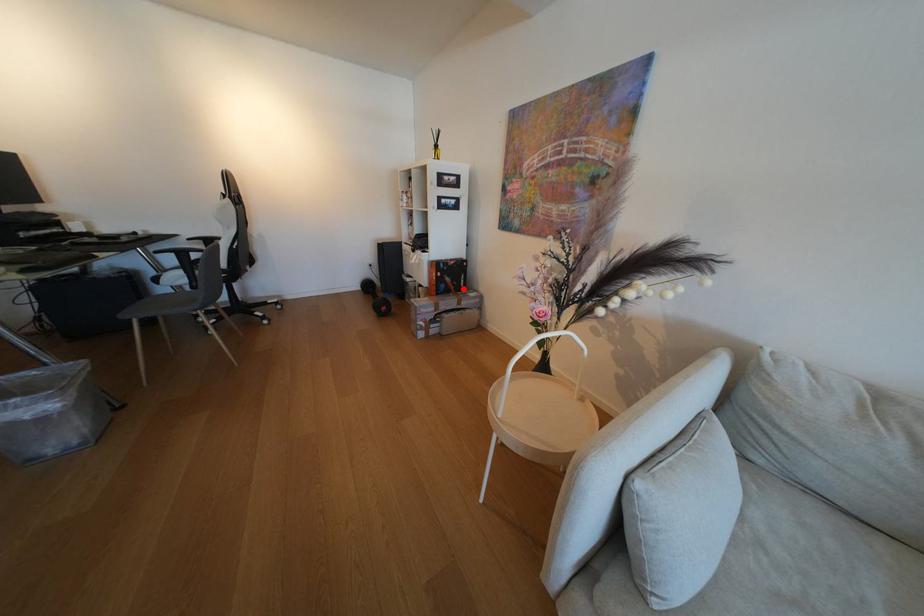
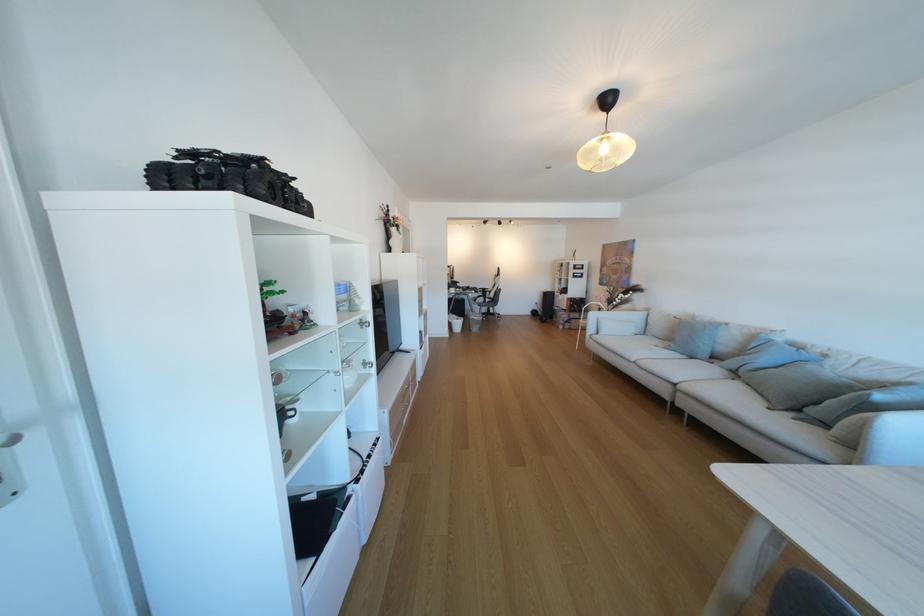
Question: I am providing you with two images of the same scene from different viewpoints. In image1, a red point is highlighted. Considering the same 3D point in image2, which of the following is correct?

Choices:
 (A) It is closer
 (B) It is farther

Answer: (A)